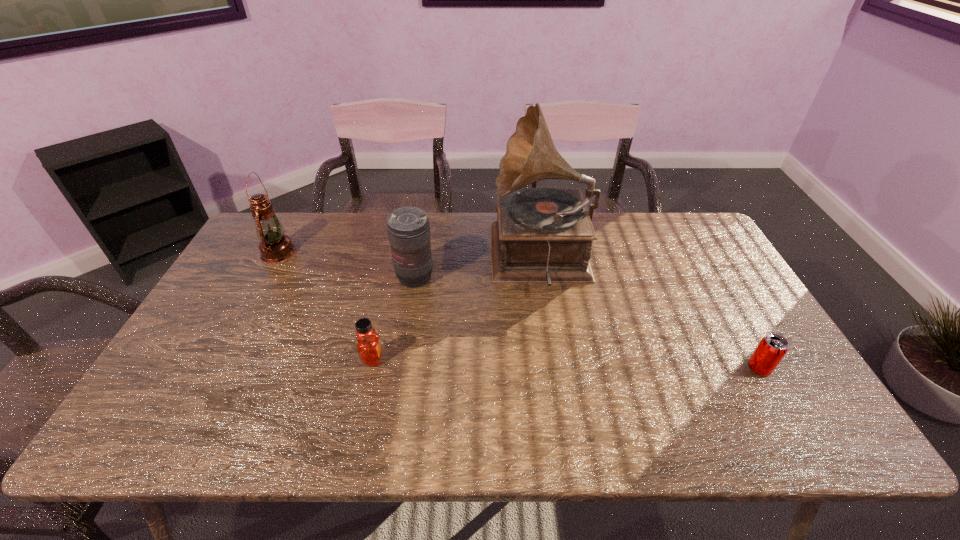
You are a GUI agent. You are given a task and a screenshot of the screen. Output one action in this format:
    pyautogui.click(x=<x>, y=<y>)
    Task: Click on the free space located from the horn of the fourth object from left to right
    The height and width of the screenshot is (540, 960).
    Given the screenshot: What is the action you would take?
    pyautogui.click(x=382, y=258)

Find the location of a particular element. This screenshot has height=540, width=960. free space located 0.160m on the right of the oil lamp is located at coordinates (345, 253).

The height and width of the screenshot is (540, 960). In order to click on vacant region located on the side of the third shortest object where the control switches are located in this screenshot , I will do `click(409, 313)`.

Where is `free space located 0.290m on the front label of the fourth tallest object`? This screenshot has height=540, width=960. free space located 0.290m on the front label of the fourth tallest object is located at coordinates (499, 359).

This screenshot has height=540, width=960. In order to click on free space located 0.150m on the back of the rightmost object in this screenshot , I will do `click(729, 316)`.

This screenshot has height=540, width=960. I want to click on record player situated at the far edge, so click(x=542, y=235).

You are a GUI agent. You are given a task and a screenshot of the screen. Output one action in this format:
    pyautogui.click(x=<x>, y=<y>)
    Task: Click on the oil lamp that is at the far edge
    The image size is (960, 540).
    Given the screenshot: What is the action you would take?
    pyautogui.click(x=275, y=247)

The width and height of the screenshot is (960, 540). Identify the location of object present at the left edge. (275, 247).

The height and width of the screenshot is (540, 960). I want to click on object located at the right edge, so click(x=772, y=348).

Where is `object at the far left corner`? This screenshot has height=540, width=960. object at the far left corner is located at coordinates (275, 247).